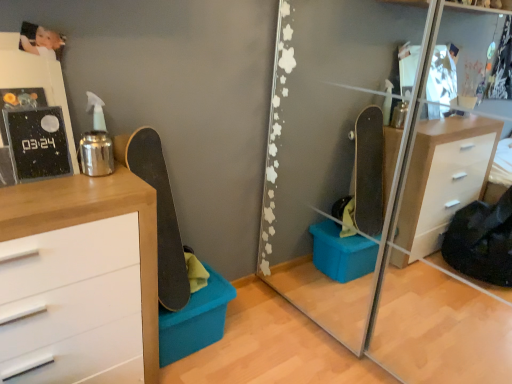
I want to click on matte blue plastic storage box at lower center, so click(195, 320).

This screenshot has width=512, height=384. Describe the element at coordinates (376, 195) in the screenshot. I see `transparent glass mirror at center` at that location.

Where is `white glossy picture frame at upper left`? The width and height of the screenshot is (512, 384). white glossy picture frame at upper left is located at coordinates (35, 80).

Considering the sizes of objects transparent glass mirror at center and matte blue plastic storage box at lower center in the image provided, who is thinner, transparent glass mirror at center or matte blue plastic storage box at lower center?

With smaller width is matte blue plastic storage box at lower center.

How many degrees apart are the facing directions of transparent glass mirror at center and matte blue plastic storage box at lower center?

90.6 degrees separate the facing orientations of transparent glass mirror at center and matte blue plastic storage box at lower center.

Is transparent glass mirror at center oriented away from matte blue plastic storage box at lower center?

No, transparent glass mirror at center's orientation is not away from matte blue plastic storage box at lower center.

Locate an element on the screen. The width and height of the screenshot is (512, 384). storage box on the left of transparent glass mirror at center is located at coordinates (195, 320).

Considering the relative sizes of white glossy picture frame at upper left and wooden chest of drawers at left in the image provided, is white glossy picture frame at upper left wider than wooden chest of drawers at left?

No, white glossy picture frame at upper left is not wider than wooden chest of drawers at left.

Is white glossy picture frame at upper left positioned with its back to wooden chest of drawers at left?

That's not correct — white glossy picture frame at upper left is not looking away from wooden chest of drawers at left.

From the image's perspective, which one is positioned higher, white glossy picture frame at upper left or wooden chest of drawers at left?

white glossy picture frame at upper left appears higher in the image.

Locate an element on the screen. The image size is (512, 384). storage box located behind the white glossy picture frame at upper left is located at coordinates (195, 320).

Is white glossy picture frame at upper left at the back of matte blue plastic storage box at lower center?

No.

Is white glossy picture frame at upper left completely or partially inside matte blue plastic storage box at lower center?

Actually, white glossy picture frame at upper left is outside matte blue plastic storage box at lower center.

Considering the sizes of matte blue plastic storage box at lower center and white glossy picture frame at upper left in the image, is matte blue plastic storage box at lower center wider or thinner than white glossy picture frame at upper left?

Considering their sizes, matte blue plastic storage box at lower center looks broader than white glossy picture frame at upper left.

Measure the distance from transparent glass mirror at center to smooth black skateboard at left.

The distance of transparent glass mirror at center from smooth black skateboard at left is 3.80 feet.

Is point (456, 380) positioned after point (148, 135)?

Yes, it is behind point (148, 135).

From the picture: Between transparent glass mirror at center and smooth black skateboard at left, which one has smaller width?

With smaller width is smooth black skateboard at left.

Considering the positions of objects transparent glass mirror at center and smooth black skateboard at left in the image provided, who is more to the left, transparent glass mirror at center or smooth black skateboard at left?

smooth black skateboard at left is more to the left.

From a real-world perspective, is smooth black skateboard at left positioned under transparent glass mirror at center based on gravity?

Yes, from a real-world perspective, smooth black skateboard at left is beneath transparent glass mirror at center.

In the scene shown: Considering the sizes of objects smooth black skateboard at left and transparent glass mirror at center in the image provided, who is taller, smooth black skateboard at left or transparent glass mirror at center?

Standing taller between the two is transparent glass mirror at center.

Visually, is smooth black skateboard at left positioned to the left or to the right of transparent glass mirror at center?

Based on their positions, smooth black skateboard at left is located to the left of transparent glass mirror at center.

Considering the positions of points (182, 272) and (410, 343), is point (182, 272) farther from camera compared to point (410, 343)?

That is False.

Is wooden chest of drawers at left in front of smooth black skateboard at left?

That is True.

Who is smaller, wooden chest of drawers at left or smooth black skateboard at left?

smooth black skateboard at left.

Is wooden chest of drawers at left located outside smooth black skateboard at left?

That's correct, wooden chest of drawers at left is outside of smooth black skateboard at left.

I want to click on chest of drawers on the left of smooth black skateboard at left, so click(91, 221).

Which is closer, [4,38] or [350,172]?

Point [4,38] is positioned closer to the camera compared to point [350,172].

Considering the sizes of objects white glossy picture frame at upper left and transparent glass mirror at center in the image provided, who is smaller, white glossy picture frame at upper left or transparent glass mirror at center?

white glossy picture frame at upper left.

Is white glossy picture frame at upper left facing towards transparent glass mirror at center?

No, white glossy picture frame at upper left is not aimed at transparent glass mirror at center.

From the image's perspective, is white glossy picture frame at upper left beneath transparent glass mirror at center?

Actually, white glossy picture frame at upper left appears above transparent glass mirror at center in the image.

Locate an element on the screen. mirror on the right side of matte blue plastic storage box at lower center is located at coordinates (376, 195).

Identify the location of the chest of drawers in front of the white glossy picture frame at upper left. The width and height of the screenshot is (512, 384). (91, 221).

From the image, which object appears to be farther from matte blue plastic storage box at lower center, white glossy picture frame at upper left or smooth black skateboard at left?

Among the two, white glossy picture frame at upper left is located further to matte blue plastic storage box at lower center.

From the image, which object appears to be farther from transparent glass mirror at center, wooden chest of drawers at left or smooth black skateboard at left?

The object further to transparent glass mirror at center is wooden chest of drawers at left.

When comparing their distances from wooden chest of drawers at left, does smooth black skateboard at left or white glossy picture frame at upper left seem closer?

smooth black skateboard at left is positioned closer to the anchor wooden chest of drawers at left.

Which object lies nearer to the anchor point smooth black skateboard at left, matte blue plastic storage box at lower center or transparent glass mirror at center?

matte blue plastic storage box at lower center lies closer to smooth black skateboard at left than the other object.

Estimate the real-world distances between objects in this image. Which object is closer to transparent glass mirror at center, matte blue plastic storage box at lower center or wooden chest of drawers at left?

matte blue plastic storage box at lower center lies closer to transparent glass mirror at center than the other object.

From the image, which object appears to be nearer to white glossy picture frame at upper left, smooth black skateboard at left or matte blue plastic storage box at lower center?

The object closer to white glossy picture frame at upper left is smooth black skateboard at left.

Considering their positions, is transparent glass mirror at center positioned closer to matte blue plastic storage box at lower center than white glossy picture frame at upper left?

white glossy picture frame at upper left.

Estimate the real-world distances between objects in this image. Which object is further from wooden chest of drawers at left, transparent glass mirror at center or smooth black skateboard at left?

transparent glass mirror at center.

Locate an element on the screen. Image resolution: width=512 pixels, height=384 pixels. skateboard that lies between white glossy picture frame at upper left and matte blue plastic storage box at lower center from top to bottom is located at coordinates (161, 217).

I want to click on storage box located between white glossy picture frame at upper left and transparent glass mirror at center in the left-right direction, so click(x=195, y=320).

In order to click on storage box between smooth black skateboard at left and transparent glass mirror at center in the horizontal direction in this screenshot , I will do `click(195, 320)`.

This screenshot has width=512, height=384. I want to click on skateboard between white glossy picture frame at upper left and transparent glass mirror at center in the horizontal direction, so click(161, 217).